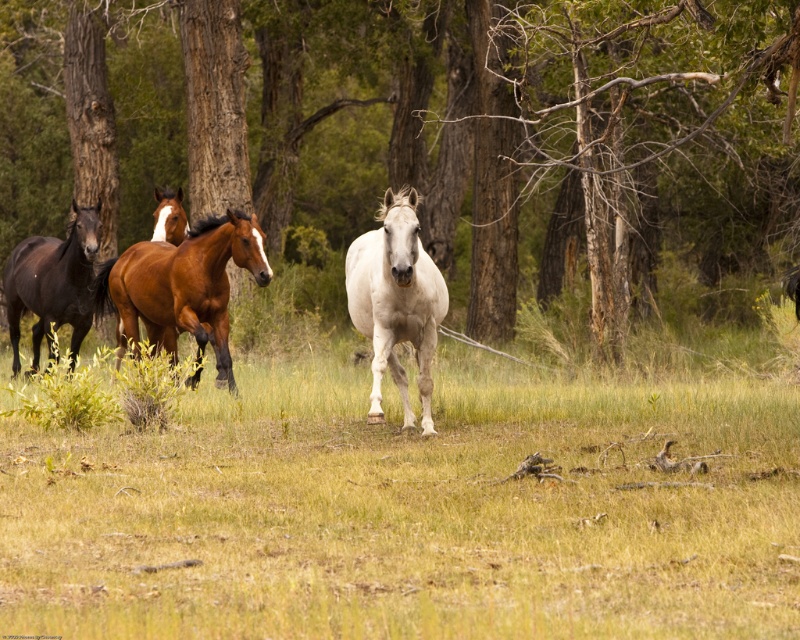
Based on the photo, does brown wood tree at center have a lesser height compared to brown glossy horse at center?

In fact, brown wood tree at center may be taller than brown glossy horse at center.

Which is more to the left, brown wood tree at center or brown glossy horse at center?

Positioned to the left is brown glossy horse at center.

Is point (608, 285) farther from viewer compared to point (180, 218)?

That is True.

Where is `brown wood tree at center`? Image resolution: width=800 pixels, height=640 pixels. brown wood tree at center is located at coordinates (432, 134).

Between brown glossy horse at left and shiny brown horse at left, which one has less height?

brown glossy horse at left is shorter.

Who is more forward, (144,259) or (84,328)?

Point (144,259)

Locate an element on the screen. This screenshot has width=800, height=640. brown glossy horse at left is located at coordinates (182, 285).

Is brown glossy horse at left wider than white glossy horse at center?

Correct, the width of brown glossy horse at left exceeds that of white glossy horse at center.

Which is above, brown glossy horse at left or white glossy horse at center?

white glossy horse at center

Locate an element on the screen. brown glossy horse at left is located at coordinates (182, 285).